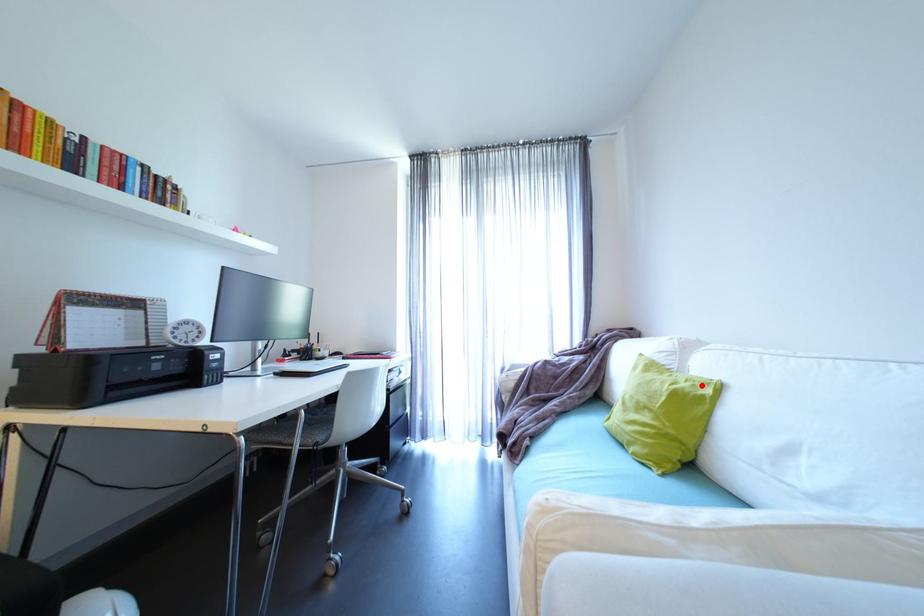
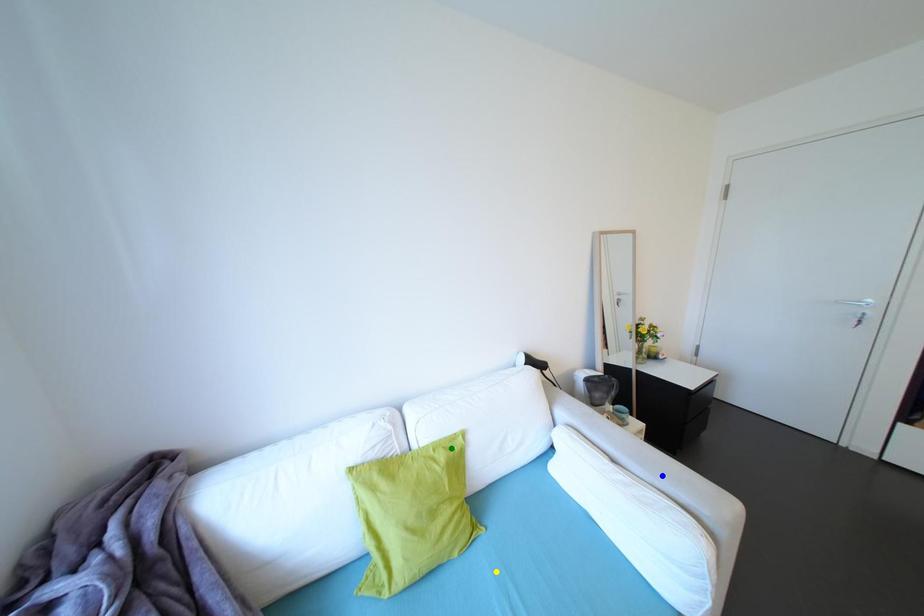
Question: I am providing you with two images of the same scene from different viewpoints. A red point is marked on the first image. You are given multiple points on the second image. Can you choose the point in image 2 that corresponds to the point in image 1?

Choices:
 (A) yellow point
 (B) green point
 (C) blue point

Answer: (B)